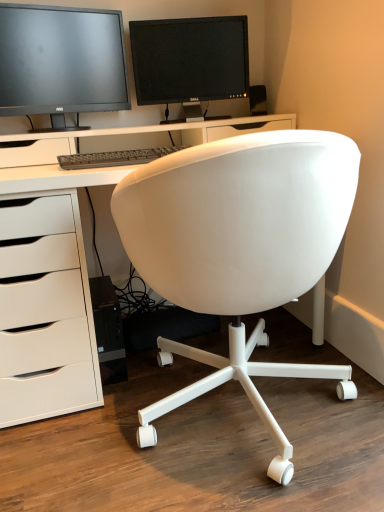
Locate an element on the screen. The image size is (384, 512). vacant space underneath white matte office chair at center (from a real-world perspective) is located at coordinates (247, 417).